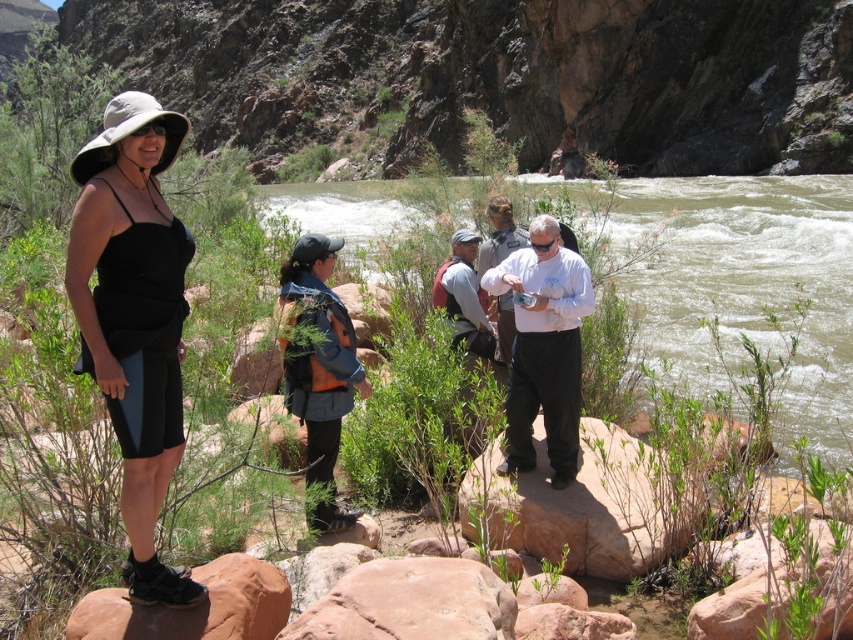
Question: Does brown sediment stream at center appear on the right side of matte black dress at center?

Choices:
 (A) yes
 (B) no

Answer: (A)

Question: Which object is positioned closest to the matte black dress at center?

Choices:
 (A) brown sediment stream at center
 (B) blue fabric backpack at center

Answer: (B)

Question: Which of the following is the closest to the observer?

Choices:
 (A) (341, 518)
 (B) (512, 380)

Answer: (A)

Question: Which point is closer to the camera taking this photo?

Choices:
 (A) (573, 509)
 (B) (68, 618)

Answer: (B)

Question: Is matte black dress at center to the right of white matte shirt at center from the viewer's perspective?

Choices:
 (A) yes
 (B) no

Answer: (B)

Question: Can you confirm if reddish-brown rock at lower left is smaller than camouflage fabric backpack at center?

Choices:
 (A) no
 (B) yes

Answer: (B)